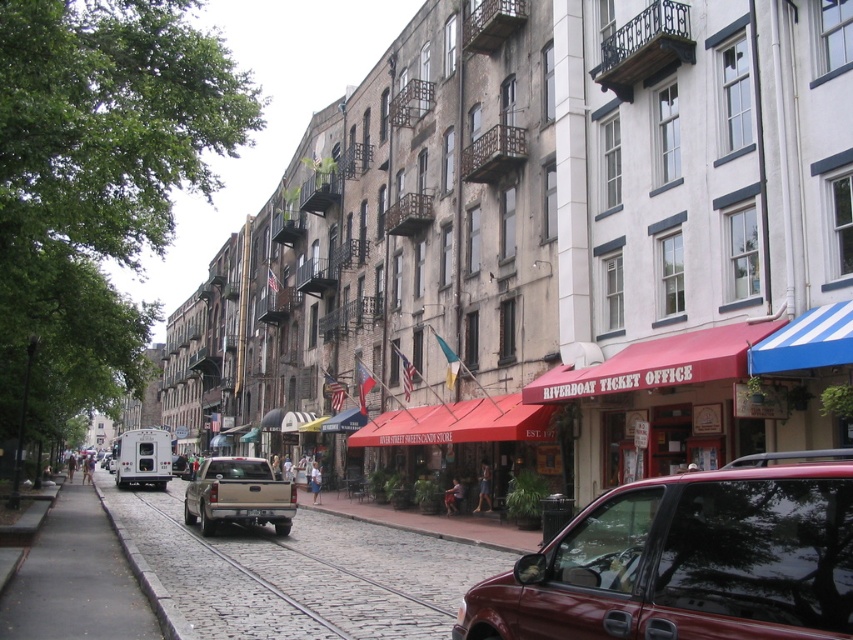
You are a tourist standing at the center of the street. You want to take a photo of the shiny red car at lower right. Where should you position yourself to capture it in your camera frame?

The shiny red car at lower right is located at coordinates point (686, 563), so you should position yourself at the center of the street facing towards the lower right direction to capture it in your camera frame.

You are a tourist standing at the entrance of the street, looking towards the shops with red awnings. You see the gray cobblestone pavement at lower left and the tan matte truck at center. Which object is positioned higher from your viewpoint?

The gray cobblestone pavement at lower left is located above the tan matte truck at center, so it is positioned higher from your viewpoint.

You are standing on the cobblestone road in the historic district and want to take a photo of the point at coordinates (38, 621). Since the point is 36.82 feet away, will it be in focus if your camera has a depth of field that extends 40 feet from where you are standing?

The point at coordinates (38, 621) is 36.82 feet away from you, which is within the camera depth of field range of 40 feet. Therefore, the point will be in focus.